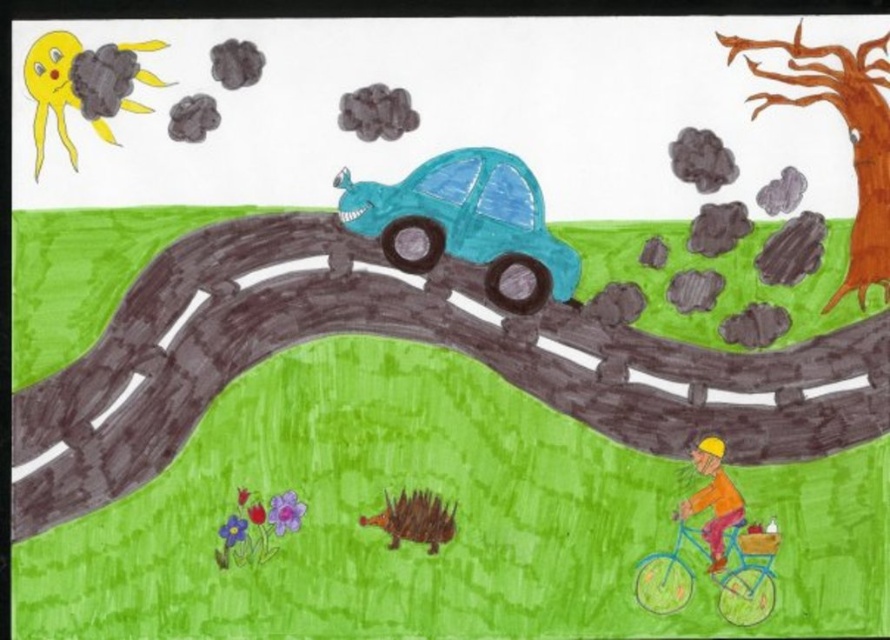
Question: Which point appears farthest from the camera in this image?

Choices:
 (A) (730, 522)
 (B) (666, 611)
 (C) (866, 84)
 (D) (484, 192)

Answer: (D)

Question: Is teal matte car at center wider than orange matte bicycle rider at lower right?

Choices:
 (A) no
 (B) yes

Answer: (B)

Question: Can you confirm if teal matte car at center is bigger than brown rough bark tree at upper right?

Choices:
 (A) yes
 (B) no

Answer: (B)

Question: Is brown rough bark tree at upper right closer to the viewer compared to blue matte bicycle at lower right?

Choices:
 (A) no
 (B) yes

Answer: (B)

Question: Which point is farther to the camera?

Choices:
 (A) brown rough bark tree at upper right
 (B) blue matte bicycle at lower right
 (C) teal matte car at center
 (D) orange matte bicycle rider at lower right

Answer: (C)

Question: Which object appears closest to the camera in this image?

Choices:
 (A) teal matte car at center
 (B) orange matte bicycle rider at lower right

Answer: (B)